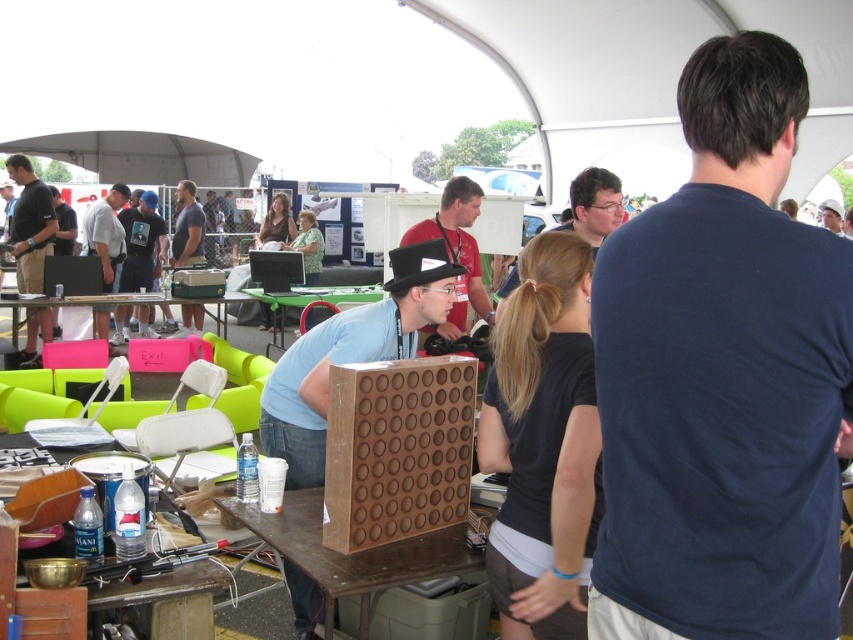
Is matte black shirt at left to the right of dark blue t-shirt at center from the viewer's perspective?

Incorrect, matte black shirt at left is not on the right side of dark blue t-shirt at center.

Which is behind, point (32, 284) or point (173, 248)?

The point (173, 248) is more distant.

The image size is (853, 640). Find the location of `matte black shirt at left`. matte black shirt at left is located at coordinates (30, 225).

Between point (614, 189) and point (286, 298), which one is positioned behind?

The point (286, 298) is more distant.

Between matte black shirt at center and wooden at center, which one is positioned lower?

wooden at center is lower down.

Locate an element on the screen. matte black shirt at center is located at coordinates (595, 205).

Is brown wooden board at center above matte red shirt at center?

Actually, brown wooden board at center is below matte red shirt at center.

Is point (286, 544) closer to camera compared to point (469, 198)?

Yes, it is in front of point (469, 198).

Find the location of a particular element. This screenshot has width=853, height=640. brown wooden board at center is located at coordinates (351, 554).